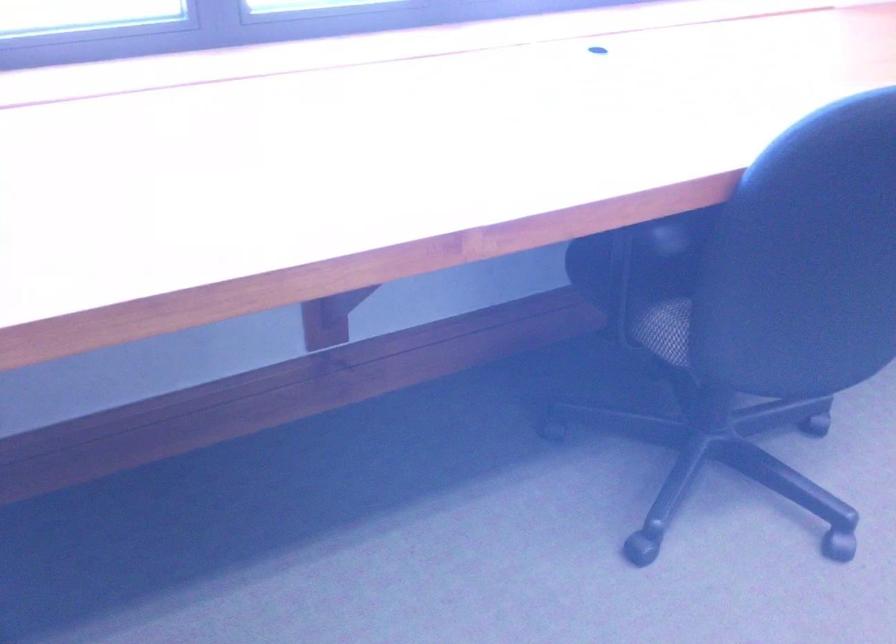
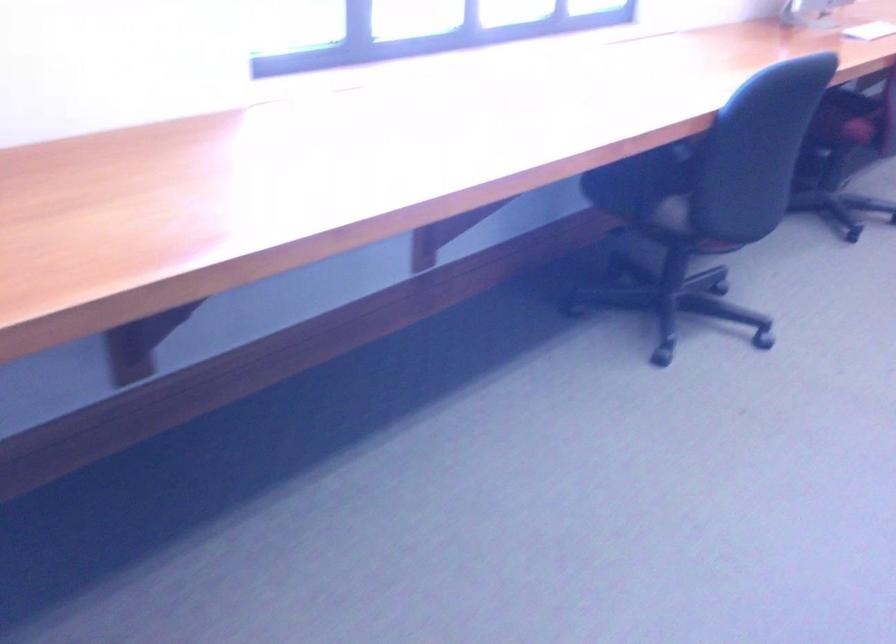
What movement of the cameraman would produce the second image?

The movement direction of the cameraman is left, backward.